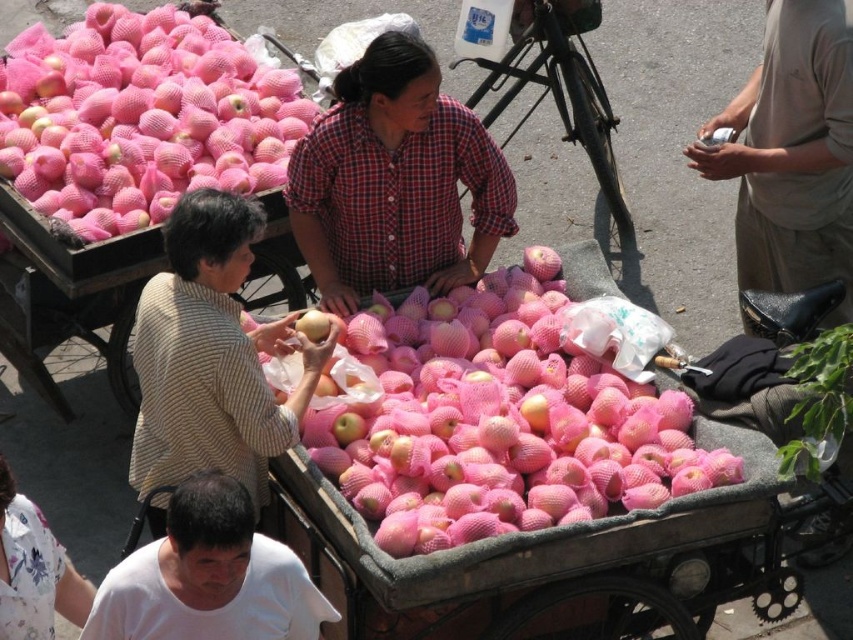
Who is more distant from viewer, (120, 67) or (837, 246)?

The point (120, 67) is more distant.

Locate an element on the screen. pink mesh bag at center is located at coordinates [109, 198].

Does point (335, 456) come closer to viewer compared to point (227, 618)?

No, it is behind (227, 618).

Which is in front, point (415, 465) or point (202, 486)?

Point (202, 486) is in front.

The image size is (853, 640). In order to click on pink mesh bagged apples at center in this screenshot , I will do `click(495, 420)`.

Can you confirm if pink mesh bagged apples at center is smaller than pink mesh bagged apples at upper left?

Yes, pink mesh bagged apples at center is smaller than pink mesh bagged apples at upper left.

Does pink mesh bagged apples at center have a larger size compared to pink mesh bagged apples at upper left?

No.

Describe the element at coordinates (495, 420) in the screenshot. I see `pink mesh bagged apples at center` at that location.

Find the location of a particular element. pink mesh bagged apples at center is located at coordinates (495, 420).